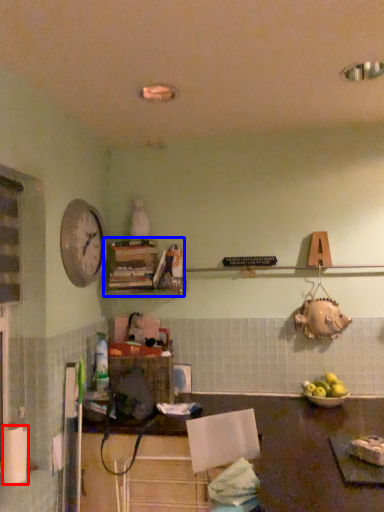
Question: Which point is further to the camera, paper towel (highlighted by a red box) or shelf (highlighted by a blue box)?

Choices:
 (A) paper towel
 (B) shelf

Answer: (B)